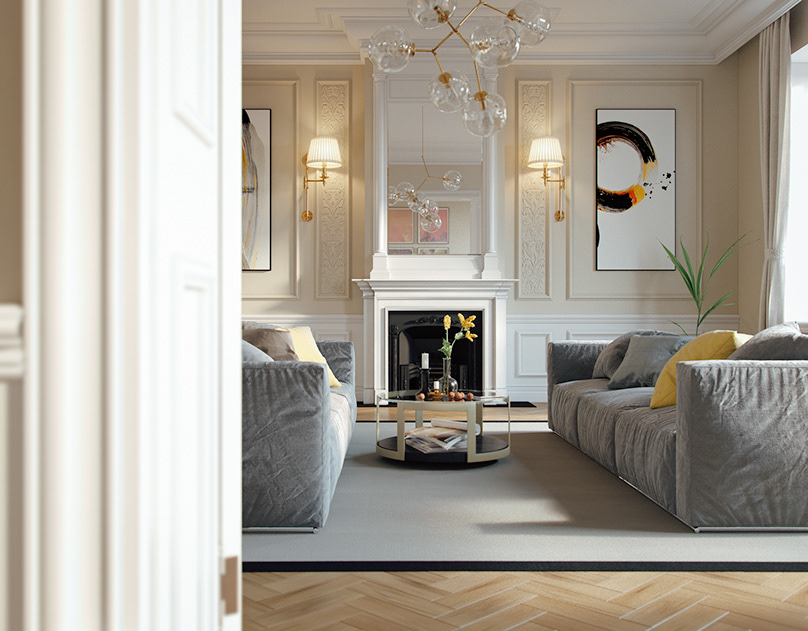
Identify the location of coffee table. (423, 402).